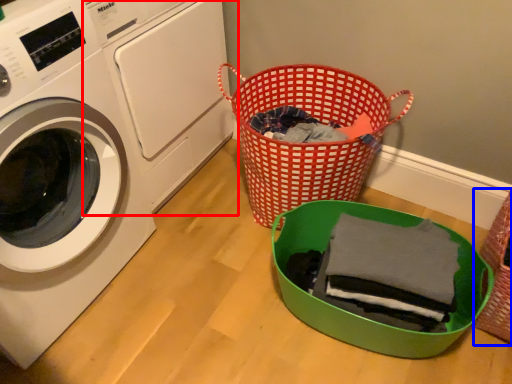
Question: Which object appears farthest to the camera in this image, washing machine (highlighted by a red box) or basket (highlighted by a blue box)?

Choices:
 (A) washing machine
 (B) basket

Answer: (A)